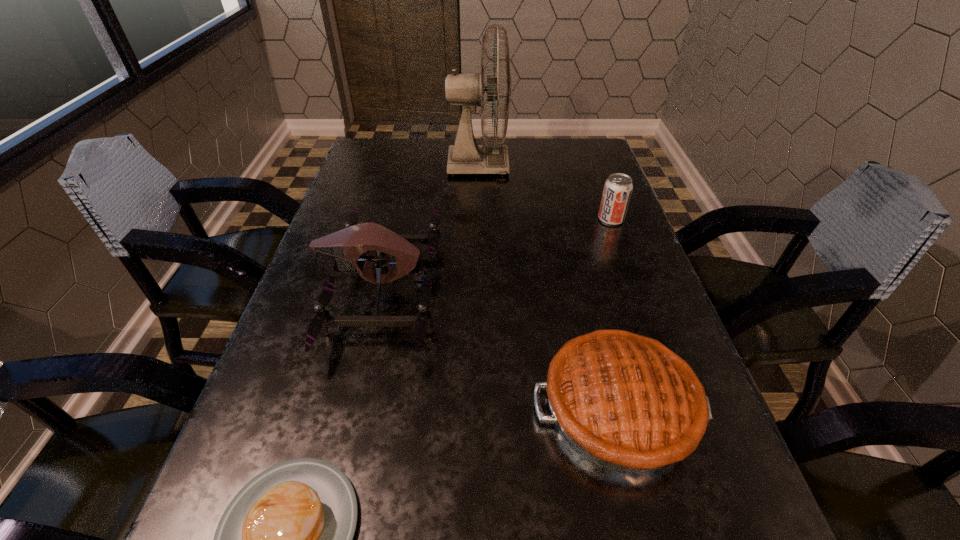
Find the location of `object that is at the left edge`. object that is at the left edge is located at coordinates (347, 245).

I want to click on soda can present at the right edge, so click(x=617, y=191).

This screenshot has width=960, height=540. In order to click on pie located in the right edge section of the desktop in this screenshot , I will do `click(628, 403)`.

The image size is (960, 540). I want to click on free space at the far edge, so click(x=414, y=153).

The image size is (960, 540). Identify the location of free space at the left edge of the desktop. point(349,206).

Image resolution: width=960 pixels, height=540 pixels. I want to click on vacant space at the right edge of the desktop, so click(638, 261).

Where is `blank space at the far right corner of the desktop`? blank space at the far right corner of the desktop is located at coordinates (597, 163).

Find the location of `vacant area that lies between the second tallest object and the soda can`. vacant area that lies between the second tallest object and the soda can is located at coordinates pyautogui.click(x=496, y=254).

Locate an element on the screen. This screenshot has height=540, width=960. free space between the tallest object and the fourth shortest object is located at coordinates (430, 227).

Identify the location of vacant space in between the farthest object and the pie. (548, 286).